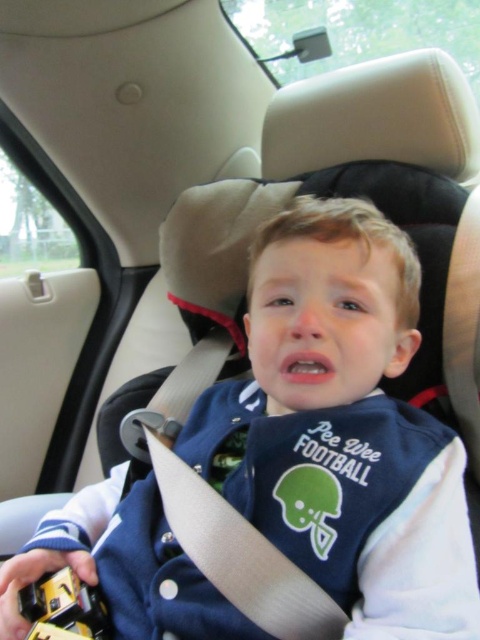
You are a parent trying to reach for the yellow plastic toy at lower left while your child is wearing the blue fabric jacket at center in the car seat. Can you safely grab the toy without disturbing the child?

The distance between the blue fabric jacket at center and the yellow plastic toy at lower left is 12.11 inches, so you can safely grab the toy without disturbing the child.

You are a parent trying to locate your child in the car. You see the blue fabric jacket at center and the yellow plastic toy at lower left. Which object is closer to you?

The blue fabric jacket at center is closer to you because it is in front of the yellow plastic toy at lower left.

You are a parent trying to decide whether to put a yellow plastic toy at lower left into the pocket of the blue fabric jacket at center. Based on the size, will the toy fit inside the jacket pocket?

The blue fabric jacket at center is wider than the yellow plastic toy at lower left, so the toy should fit inside the jacket pocket.